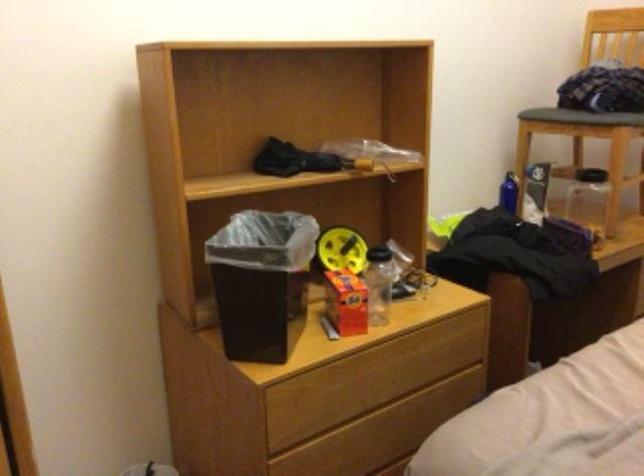
I want to click on green chair surface, so click(569, 116).